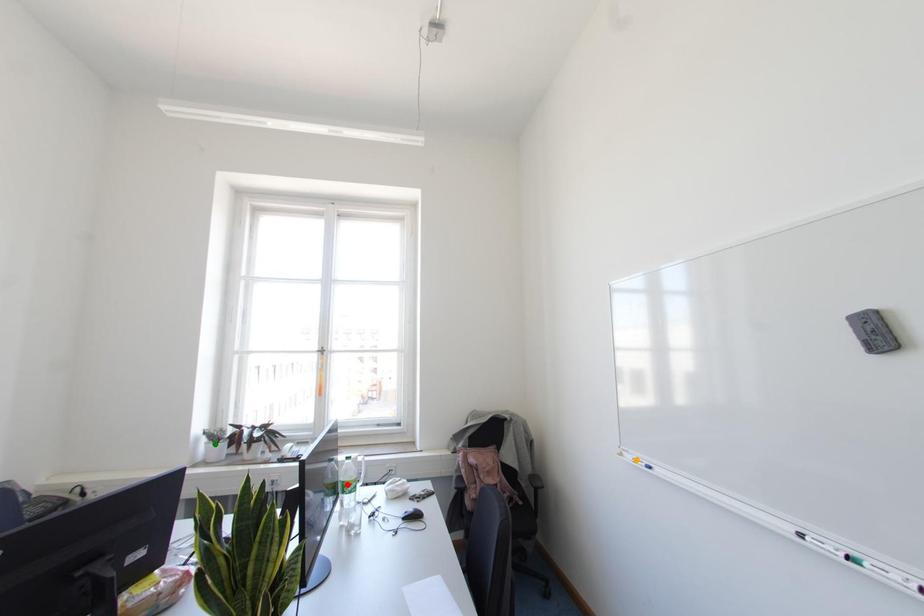
Consider the image. Order these from nearest to farthest:
1. red point
2. green point
3. orange point

green point, red point, orange point